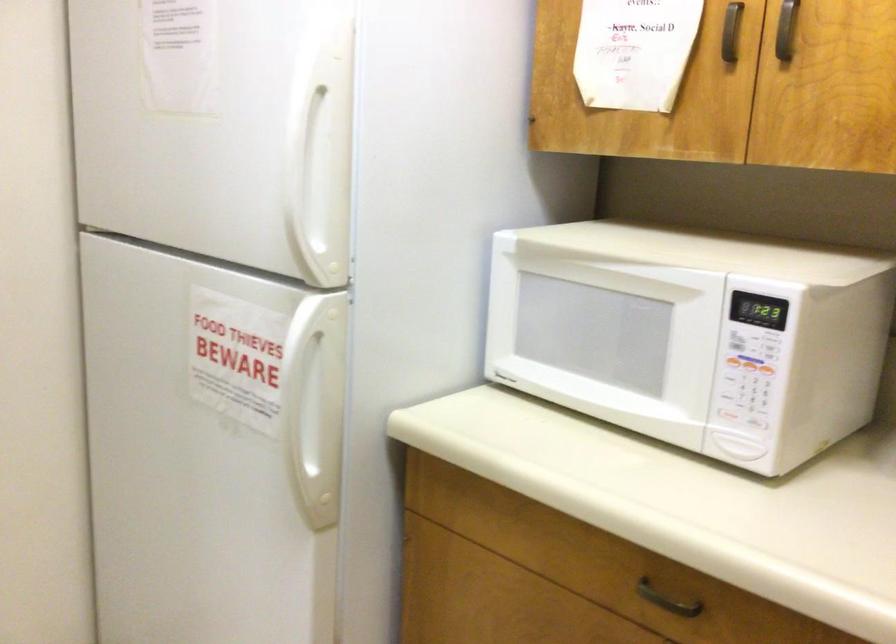
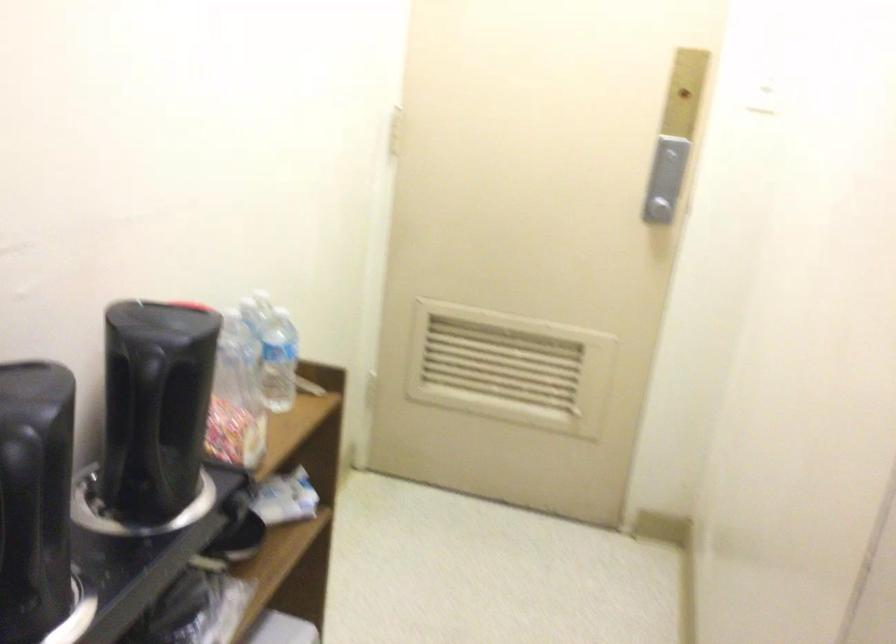
Question: The first image is from the beginning of the video and the second image is from the end. How did the camera likely rotate when shooting the video?

Choices:
 (A) Left
 (B) Right
 (C) Up
 (D) Down

Answer: (A)